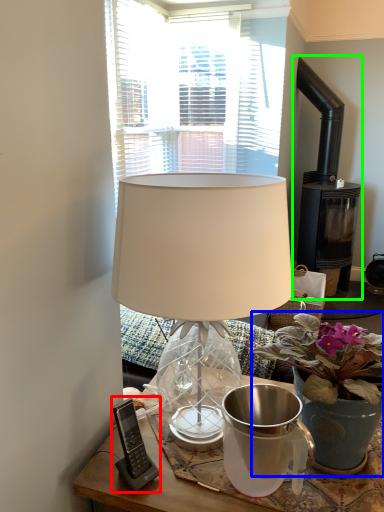
Question: Which is nearer to the gadget (highlighted by a red box)? houseplant (highlighted by a blue box) or fireplace (highlighted by a green box).

Choices:
 (A) houseplant
 (B) fireplace

Answer: (A)